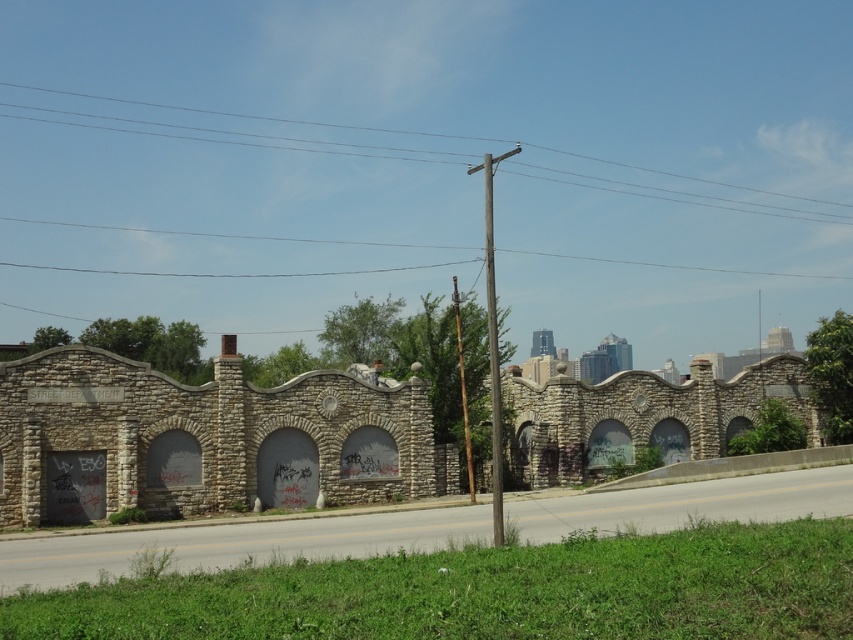
Is gray concrete highway at lower center above wooden pole at upper center?

No, gray concrete highway at lower center is not above wooden pole at upper center.

Who is positioned more to the left, gray concrete highway at lower center or wooden pole at upper center?

wooden pole at upper center is more to the left.

Is point (598, 497) behind point (706, 204)?

No, (598, 497) is in front of (706, 204).

Where is `gray concrete highway at lower center`? This screenshot has height=640, width=853. gray concrete highway at lower center is located at coordinates (236, 544).